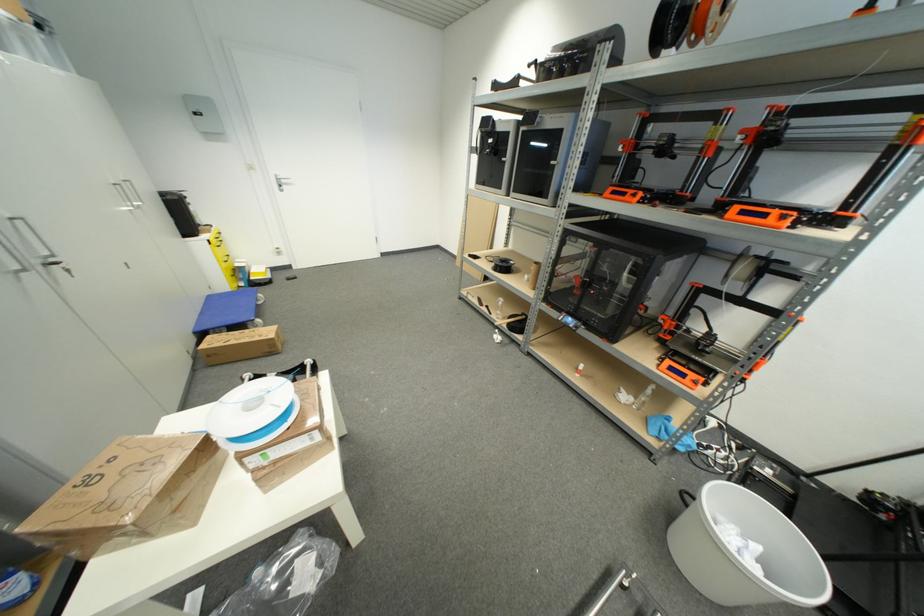
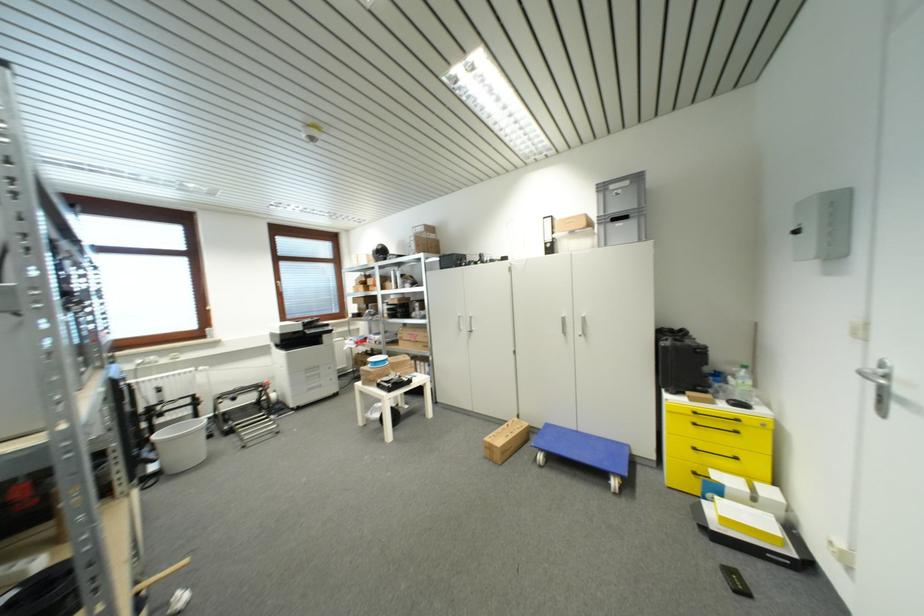
The point at (x=290, y=187) is marked in the first image. Where is the corresponding point in the second image?

(909, 405)